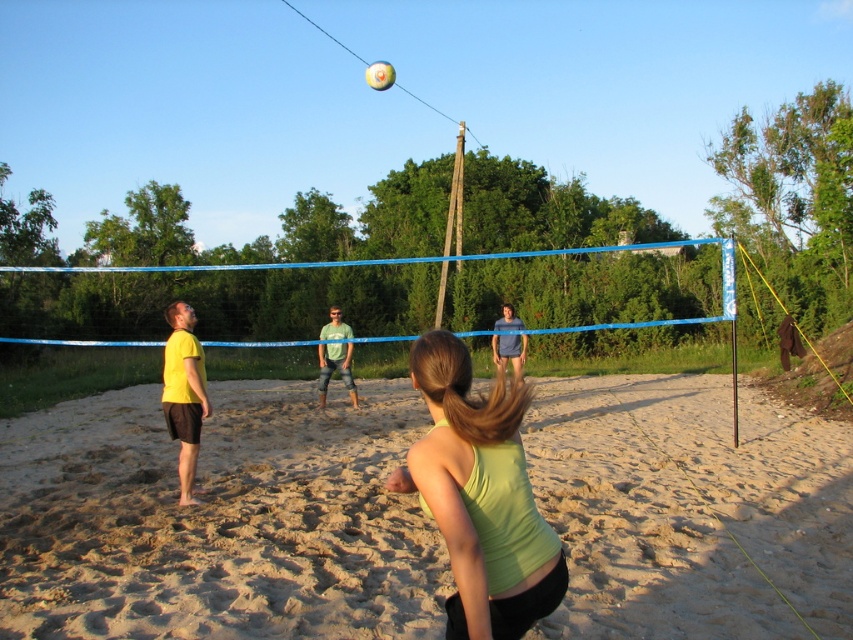
Question: Which point is closer to the camera taking this photo?

Choices:
 (A) (281, 474)
 (B) (180, 493)
 (C) (521, 625)

Answer: (C)

Question: Can you confirm if green matte tank top at center is bigger than white matte volleyball at upper center?

Choices:
 (A) no
 (B) yes

Answer: (A)

Question: Which point is farther from the camera taking this photo?

Choices:
 (A) (505, 346)
 (B) (384, 68)

Answer: (B)

Question: Is green matte tank top at center closer to the viewer compared to white matte volleyball at upper center?

Choices:
 (A) no
 (B) yes

Answer: (B)

Question: Is brown sandy beach at center positioned behind green matte tank top at center?

Choices:
 (A) yes
 (B) no

Answer: (A)

Question: Which object is positioned farthest from the brown sandy beach at center?

Choices:
 (A) blue mesh net at center
 (B) blue fabric shirt at center
 (C) green matte tank top at center

Answer: (A)